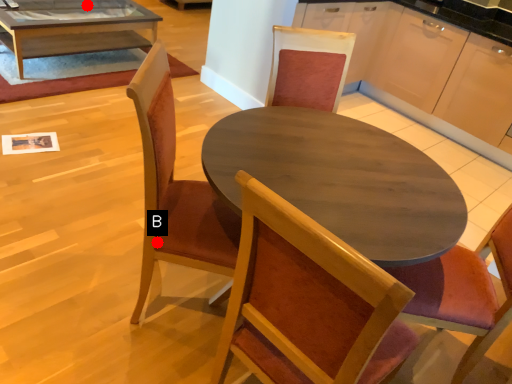
Question: Two points are circled on the image, labeled by A and B beside each circle. Which point is closer to the camera?

Choices:
 (A) A is closer
 (B) B is closer

Answer: (B)